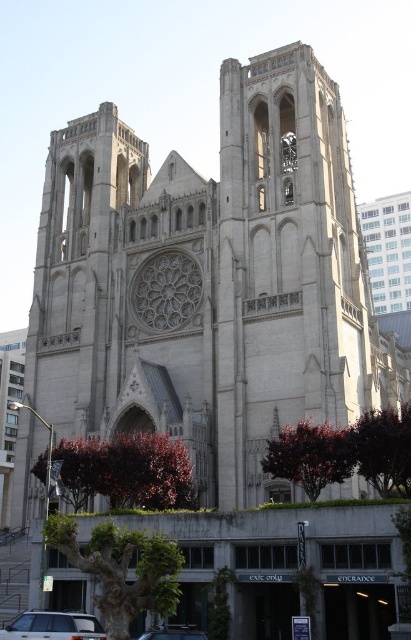
Question: Which of the following is the closest to the observer?

Choices:
 (A) (166, 634)
 (B) (80, 625)

Answer: (B)

Question: Is silver metallic suv at lower left bigger than metallic silver car at center?

Choices:
 (A) no
 (B) yes

Answer: (A)

Question: Which point is farther to the camera?

Choices:
 (A) (13, 637)
 (B) (152, 627)

Answer: (B)

Question: Can you confirm if silver metallic suv at lower left is positioned above metallic silver car at center?

Choices:
 (A) no
 (B) yes

Answer: (B)

Question: Considering the relative positions of silver metallic suv at lower left and metallic silver car at center in the image provided, where is silver metallic suv at lower left located with respect to metallic silver car at center?

Choices:
 (A) right
 (B) left

Answer: (B)

Question: Which point is farther to the camera?

Choices:
 (A) (94, 627)
 (B) (157, 634)

Answer: (A)